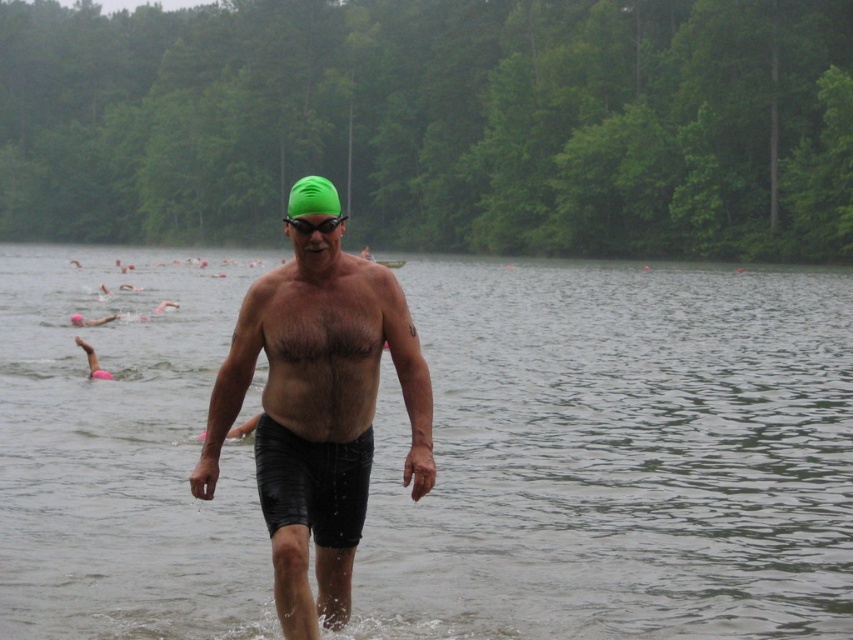
Question: Can you confirm if clear water at center is positioned below green matte swim cap at center?

Choices:
 (A) yes
 (B) no

Answer: (B)

Question: Among these points, which one is nearest to the camera?

Choices:
 (A) (364, 413)
 (B) (294, 504)

Answer: (B)

Question: Can you confirm if clear water at center is positioned above black rubber shorts at center?

Choices:
 (A) yes
 (B) no

Answer: (A)

Question: Which of the following is the closest to the observer?

Choices:
 (A) black rubber shorts at center
 (B) clear water at center

Answer: (A)

Question: Which object is positioned farthest from the green matte swim cap at center?

Choices:
 (A) clear water at center
 (B) black rubber shorts at center

Answer: (A)

Question: Can you confirm if clear water at center is bigger than black rubber shorts at center?

Choices:
 (A) no
 (B) yes

Answer: (B)